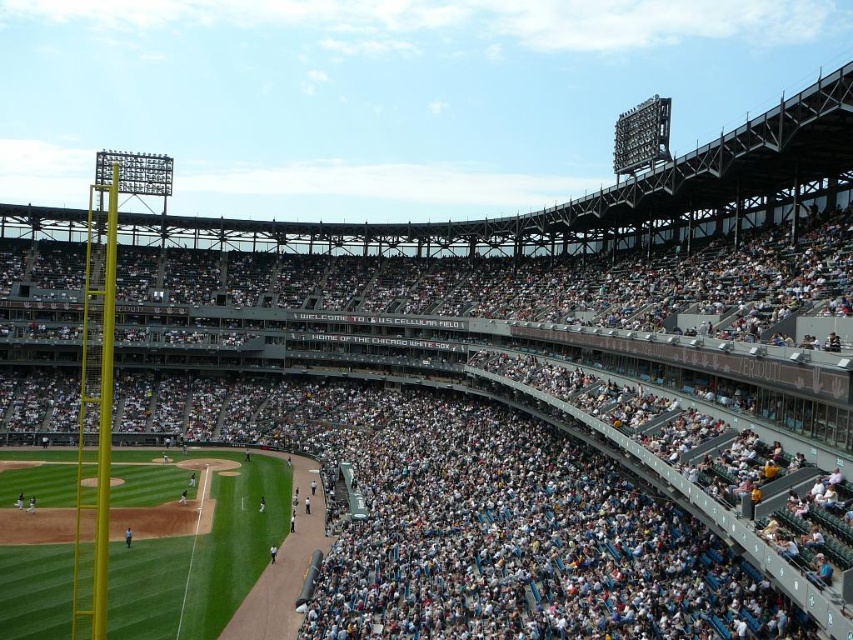
Is metallic silver baseball team at center bigger than light brown leather glove at lower left?

Correct, metallic silver baseball team at center is larger in size than light brown leather glove at lower left.

Does metallic silver baseball team at center have a greater height compared to light brown leather glove at lower left?

Yes, metallic silver baseball team at center is taller than light brown leather glove at lower left.

Locate an element on the screen. This screenshot has width=853, height=640. metallic silver baseball team at center is located at coordinates (463, 460).